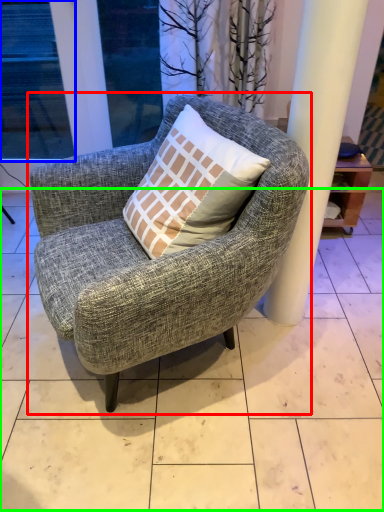
Question: Which is nearer to the chair (highlighted by a red box)? window (highlighted by a blue box) or tile (highlighted by a green box).

Choices:
 (A) window
 (B) tile

Answer: (B)